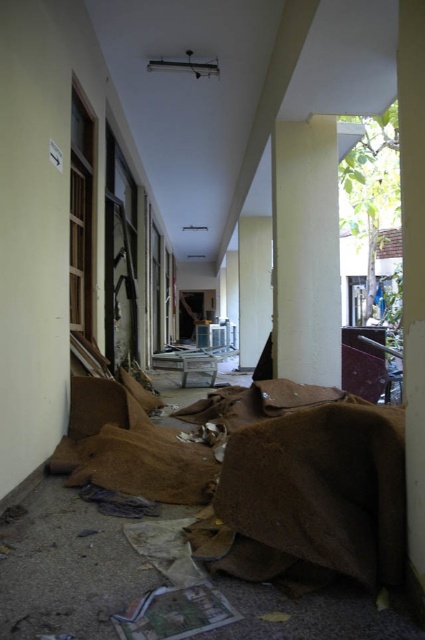
Question: Which point appears farthest from the camera in this image?

Choices:
 (A) (277, 154)
 (B) (405, 168)

Answer: (A)

Question: Is smooth concrete pillar at center below smooth concrete pillar at right?

Choices:
 (A) yes
 (B) no

Answer: (B)

Question: Does smooth concrete pillar at center appear on the right side of smooth concrete pillar at right?

Choices:
 (A) yes
 (B) no

Answer: (A)

Question: Which object is closer to the camera taking this photo?

Choices:
 (A) smooth concrete pillar at right
 (B) smooth concrete pillar at center

Answer: (A)

Question: Does smooth concrete pillar at center have a greater width compared to smooth concrete pillar at right?

Choices:
 (A) yes
 (B) no

Answer: (A)